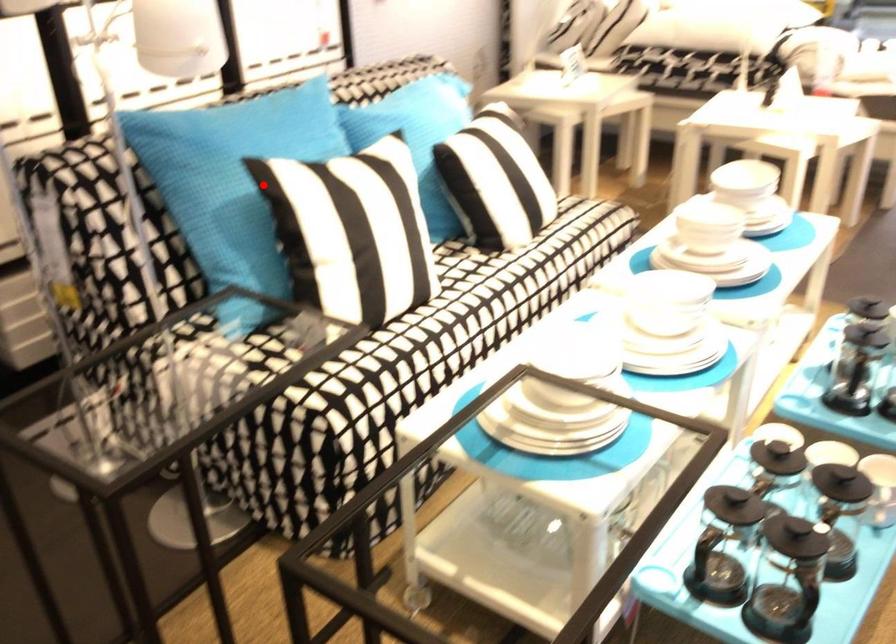
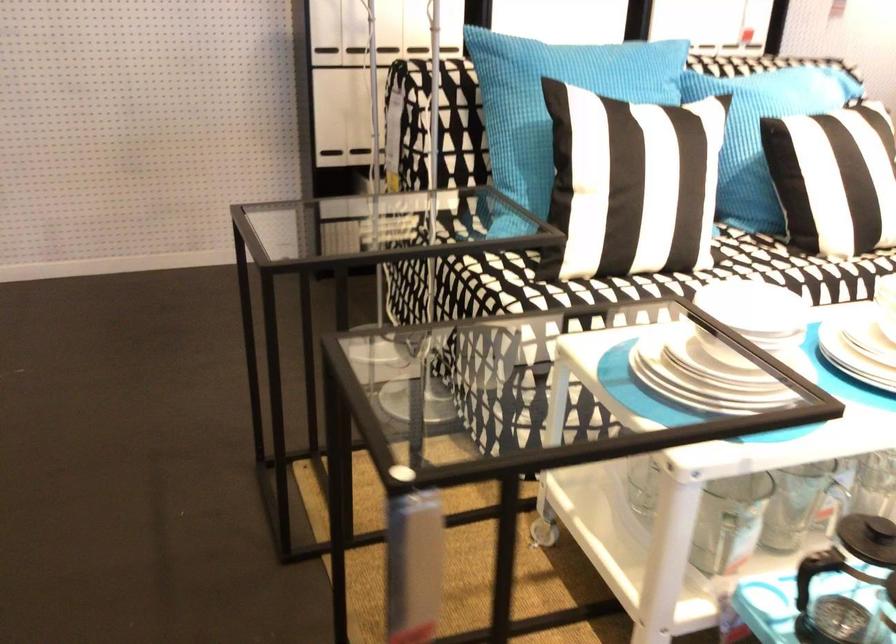
Find the pixel in the second image that matches the highlighted location in the first image.

(554, 102)